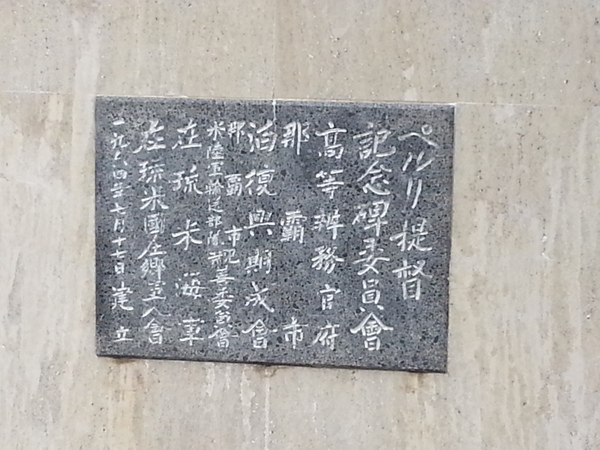
Identify the location of vertical grout line below art. This screenshot has width=600, height=450. (270, 425).